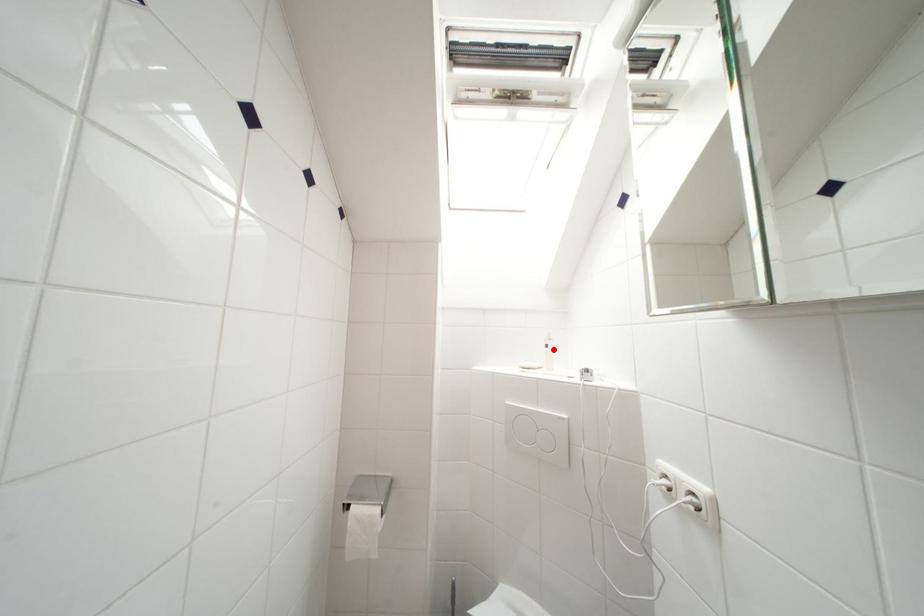
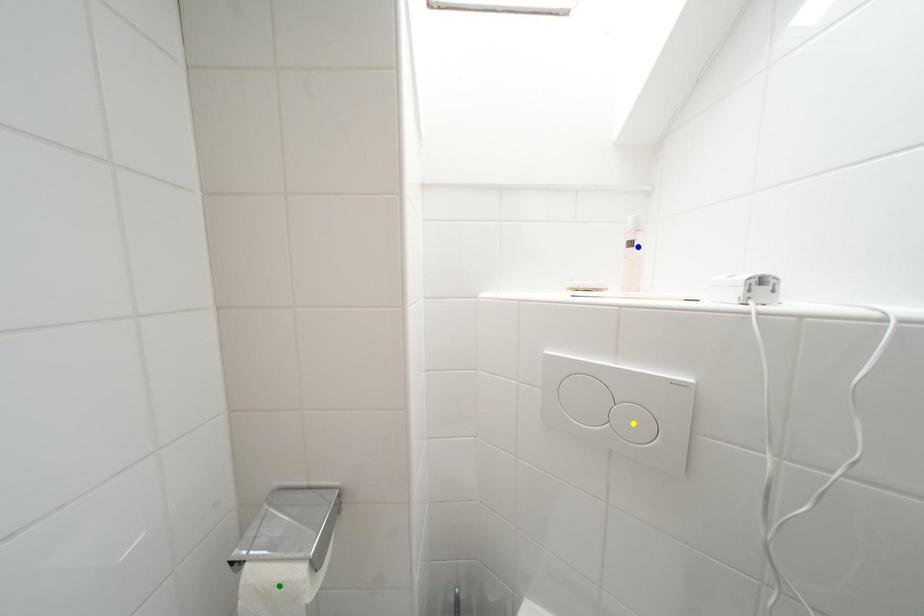
Question: I am providing you with two images of the same scene from different viewpoints. A red point is marked on the first image. You are given multiple points on the second image. Which mark in image 2 goes with the point in image 1?

Choices:
 (A) green point
 (B) blue point
 (C) yellow point

Answer: (B)